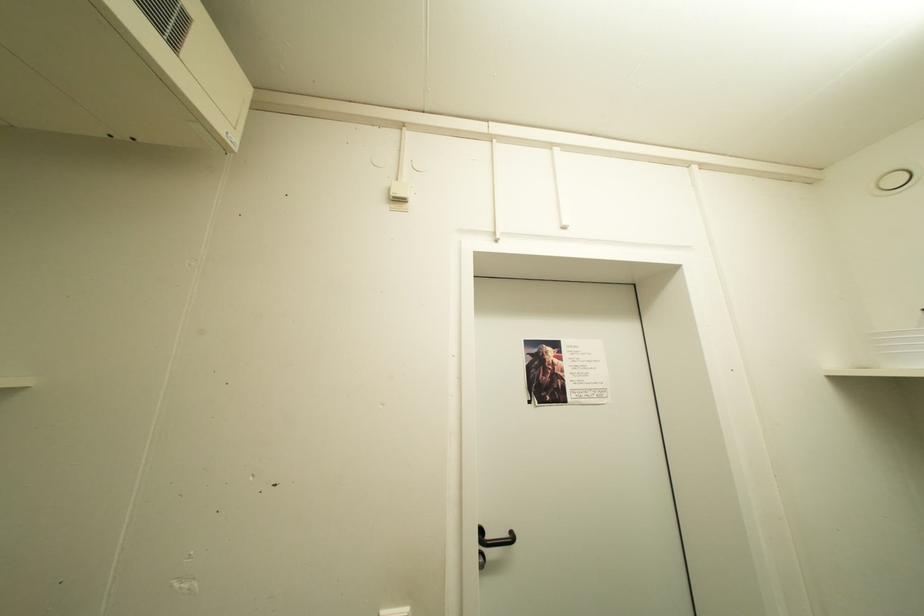
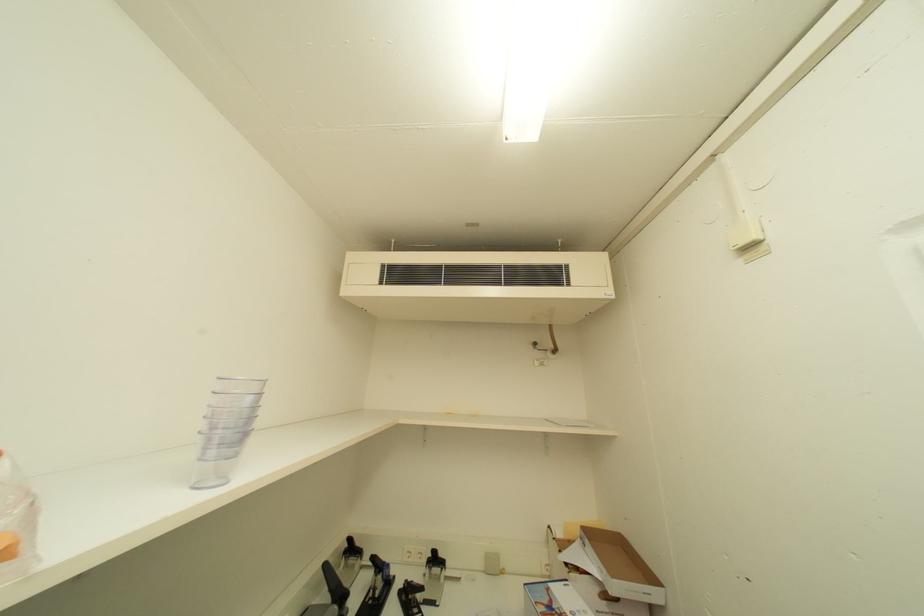
Based on the continuous images, in which direction is the camera rotating?

The camera's rotation is toward left-up.